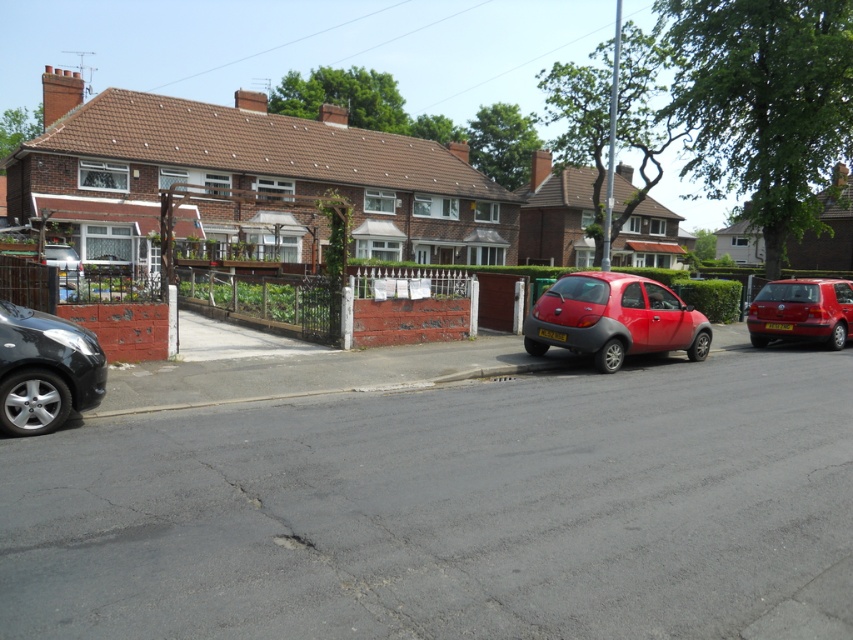
Question: Which object is closer to the camera taking this photo?

Choices:
 (A) shiny red hatchback at right
 (B) shiny red car at center

Answer: (B)

Question: Which object is positioned farthest from the shiny red hatchback at right?

Choices:
 (A) shiny black car at lower left
 (B) shiny red car at center
 (C) metallic silver car at center

Answer: (C)

Question: Does shiny black car at lower left appear over metallic silver car at center?

Choices:
 (A) yes
 (B) no

Answer: (B)

Question: Can you confirm if shiny red hatchback at right is thinner than metallic silver car at center?

Choices:
 (A) yes
 (B) no

Answer: (A)

Question: Does shiny black car at lower left have a greater width compared to shiny red hatchback at right?

Choices:
 (A) no
 (B) yes

Answer: (A)

Question: Which point is closer to the camera?

Choices:
 (A) shiny red car at center
 (B) shiny red hatchback at right

Answer: (A)